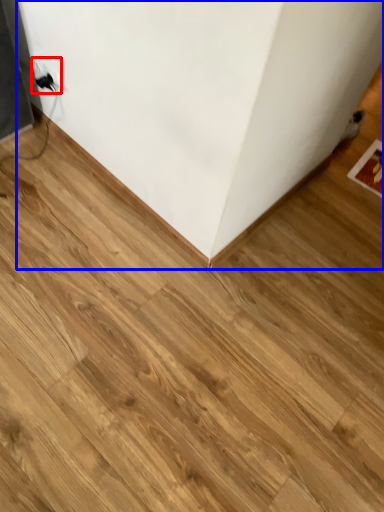
Question: Which object appears farthest to the camera in this image, electric outlet (highlighted by a red box) or furniture (highlighted by a blue box)?

Choices:
 (A) electric outlet
 (B) furniture

Answer: (A)